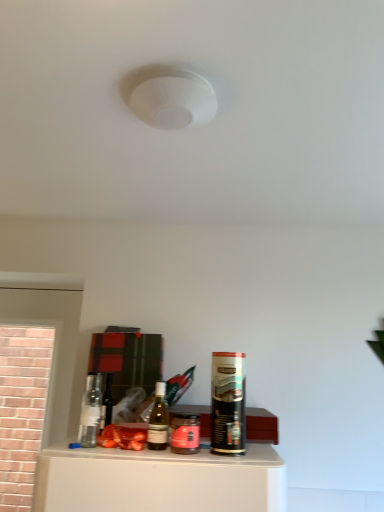
This screenshot has height=512, width=384. Describe the element at coordinates (228, 403) in the screenshot. I see `black matte spray can at right, placed as the first beverage when sorted from right to left` at that location.

Measure the distance between pink glass jar at center, which appears as the 2th beverage when viewed from the right, and camera.

The depth of pink glass jar at center, which appears as the 2th beverage when viewed from the right, is 3.49 feet.

I want to click on black matte spray can at right, arranged as the 2th beverage when viewed from the left, so click(228, 403).

Are matte glass wine bottle at center and black matte spray can at right, arranged as the 2th beverage when viewed from the left, far apart?

No, matte glass wine bottle at center is not far from black matte spray can at right, arranged as the 2th beverage when viewed from the left.

Which point is more distant from viewer, (108, 401) or (245, 449)?

Positioned behind is point (108, 401).

How different are the orientations of matte glass wine bottle at center and black matte spray can at right, placed as the first beverage when sorted from right to left, in degrees?

0.189 degrees separate the facing orientations of matte glass wine bottle at center and black matte spray can at right, placed as the first beverage when sorted from right to left.

In terms of size, does matte glass wine bottle at center appear bigger or smaller than black matte spray can at right, placed as the first beverage when sorted from right to left?

In the image, matte glass wine bottle at center appears to be smaller than black matte spray can at right, placed as the first beverage when sorted from right to left.

Is point (163, 440) positioned before point (105, 425)?

That is True.

Can you confirm if translucent glass bottle at center is bigger than matte glass wine bottle at center?

Yes.

Between black matte spray can at right, placed as the first beverage when sorted from right to left, and pink glass jar at center, which appears as the 2th beverage when viewed from the right, which one has more height?

Standing taller between the two is black matte spray can at right, placed as the first beverage when sorted from right to left.

Between point (222, 453) and point (184, 453), which one is positioned in front?

The point (184, 453) is in front.

Locate an element on the screen. This screenshot has height=512, width=384. beverage below the black matte spray can at right, placed as the first beverage when sorted from right to left (from a real-world perspective) is located at coordinates (185, 433).

Would you say black matte spray can at right, arranged as the 2th beverage when viewed from the left, is outside pink glass jar at center, which appears as the 2th beverage when viewed from the right?

black matte spray can at right, arranged as the 2th beverage when viewed from the left, lies outside pink glass jar at center, which appears as the 2th beverage when viewed from the right,'s area.

Based on the photo, can you confirm if pink glass jar at center, which is counted as the 1th beverage, starting from the left, is thinner than translucent glass bottle at center?

No.

This screenshot has height=512, width=384. What are the coordinates of `beverage below the translucent glass bottle at center (from the image's perspective)` in the screenshot? It's located at point(185,433).

Could you tell me if pink glass jar at center, which is counted as the 1th beverage, starting from the left, is facing translucent glass bottle at center?

No, pink glass jar at center, which is counted as the 1th beverage, starting from the left, is not facing towards translucent glass bottle at center.

From a real-world perspective, is pink glass jar at center, which is counted as the 1th beverage, starting from the left, physically located above or below black matte spray can at right, arranged as the 2th beverage when viewed from the left?

Clearly, from a real-world perspective, pink glass jar at center, which is counted as the 1th beverage, starting from the left, is below black matte spray can at right, arranged as the 2th beverage when viewed from the left.

Is pink glass jar at center, which appears as the 2th beverage when viewed from the right, surrounding black matte spray can at right, arranged as the 2th beverage when viewed from the left?

No, black matte spray can at right, arranged as the 2th beverage when viewed from the left, is not inside pink glass jar at center, which appears as the 2th beverage when viewed from the right.

In the image, is pink glass jar at center, which is counted as the 1th beverage, starting from the left, positioned in front of or behind black matte spray can at right, arranged as the 2th beverage when viewed from the left?

In the image, pink glass jar at center, which is counted as the 1th beverage, starting from the left, appears behind black matte spray can at right, arranged as the 2th beverage when viewed from the left.

Considering the relative positions of matte glass wine bottle at center and pink glass jar at center, which is counted as the 1th beverage, starting from the left, in the image provided, is matte glass wine bottle at center to the left or to the right of pink glass jar at center, which is counted as the 1th beverage, starting from the left,?

matte glass wine bottle at center is to the left of pink glass jar at center, which is counted as the 1th beverage, starting from the left.

Is matte glass wine bottle at center not inside pink glass jar at center, which appears as the 2th beverage when viewed from the right?

Yes, matte glass wine bottle at center is not within pink glass jar at center, which appears as the 2th beverage when viewed from the right.

Is point (101, 422) positioned behind point (185, 451)?

Yes, it is.

From a real-world perspective, is black matte spray can at right, placed as the first beverage when sorted from right to left, over translucent glass bottle at center?

Yes.

Which of these two, black matte spray can at right, placed as the first beverage when sorted from right to left, or translucent glass bottle at center, is thinner?

translucent glass bottle at center.

Consider the image. Considering the positions of objects black matte spray can at right, placed as the first beverage when sorted from right to left, and translucent glass bottle at center in the image provided, who is more to the left, black matte spray can at right, placed as the first beverage when sorted from right to left, or translucent glass bottle at center?

translucent glass bottle at center.

Is black matte spray can at right, placed as the first beverage when sorted from right to left, positioned far away from translucent glass bottle at center?

No, black matte spray can at right, placed as the first beverage when sorted from right to left, is not far from translucent glass bottle at center.

Where is `wine bottle located below the black matte spray can at right, arranged as the 2th beverage when viewed from the left (from the image's perspective)`? wine bottle located below the black matte spray can at right, arranged as the 2th beverage when viewed from the left (from the image's perspective) is located at coordinates (107, 403).

You are a GUI agent. You are given a task and a screenshot of the screen. Output one action in this format:
    pyautogui.click(x=<x>, y=<y>)
    Task: Click on the wine bottle that appears above the translucent glass bottle at center (from a real-world perspective)
    
    Given the screenshot: What is the action you would take?
    pyautogui.click(x=107, y=403)

When comparing their distances from matte glass wine bottle at center, does black matte spray can at right, arranged as the 2th beverage when viewed from the left, or pink glass jar at center, which appears as the 2th beverage when viewed from the right, seem closer?

pink glass jar at center, which appears as the 2th beverage when viewed from the right, is closer to matte glass wine bottle at center.

Considering their positions, is translucent glass bottle at center positioned closer to black matte spray can at right, arranged as the 2th beverage when viewed from the left, than matte glass wine bottle at center?

The object closer to black matte spray can at right, arranged as the 2th beverage when viewed from the left, is translucent glass bottle at center.

Estimate the real-world distances between objects in this image. Which object is closer to pink glass jar at center, which is counted as the 1th beverage, starting from the left, translucent glass bottle at center or matte glass wine bottle at center?

translucent glass bottle at center is closer to pink glass jar at center, which is counted as the 1th beverage, starting from the left.

Considering their positions, is translucent glass bottle at center positioned further to matte glass wine bottle at center than black matte spray can at right, placed as the first beverage when sorted from right to left?

Among the two, black matte spray can at right, placed as the first beverage when sorted from right to left, is located further to matte glass wine bottle at center.

Consider the image. From the image, which object appears to be nearer to translucent glass bottle at center, pink glass jar at center, which appears as the 2th beverage when viewed from the right, or matte glass wine bottle at center?

The object closer to translucent glass bottle at center is pink glass jar at center, which appears as the 2th beverage when viewed from the right.

Consider the image. Based on their spatial positions, is pink glass jar at center, which is counted as the 1th beverage, starting from the left, or black matte spray can at right, arranged as the 2th beverage when viewed from the left, closer to matte glass wine bottle at center?

The object closer to matte glass wine bottle at center is pink glass jar at center, which is counted as the 1th beverage, starting from the left.

From the picture: When comparing their distances from black matte spray can at right, arranged as the 2th beverage when viewed from the left, does pink glass jar at center, which appears as the 2th beverage when viewed from the right, or matte glass wine bottle at center seem further?

matte glass wine bottle at center lies further to black matte spray can at right, arranged as the 2th beverage when viewed from the left, than the other object.

Which object lies nearer to the anchor point matte glass wine bottle at center, translucent glass bottle at center or pink glass jar at center, which appears as the 2th beverage when viewed from the right?

translucent glass bottle at center.

Identify the location of beverage situated between matte glass wine bottle at center and black matte spray can at right, placed as the first beverage when sorted from right to left, from left to right. Image resolution: width=384 pixels, height=512 pixels. (185, 433).

This screenshot has height=512, width=384. What are the coordinates of `bottle located between matte glass wine bottle at center and black matte spray can at right, placed as the first beverage when sorted from right to left, in the left-right direction` in the screenshot? It's located at (158, 420).

Find the location of a particular element. beverage between translucent glass bottle at center and black matte spray can at right, arranged as the 2th beverage when viewed from the left, from left to right is located at coordinates (185, 433).

In order to click on bottle located between matte glass wine bottle at center and pink glass jar at center, which is counted as the 1th beverage, starting from the left, in the left-right direction in this screenshot , I will do `click(158, 420)`.